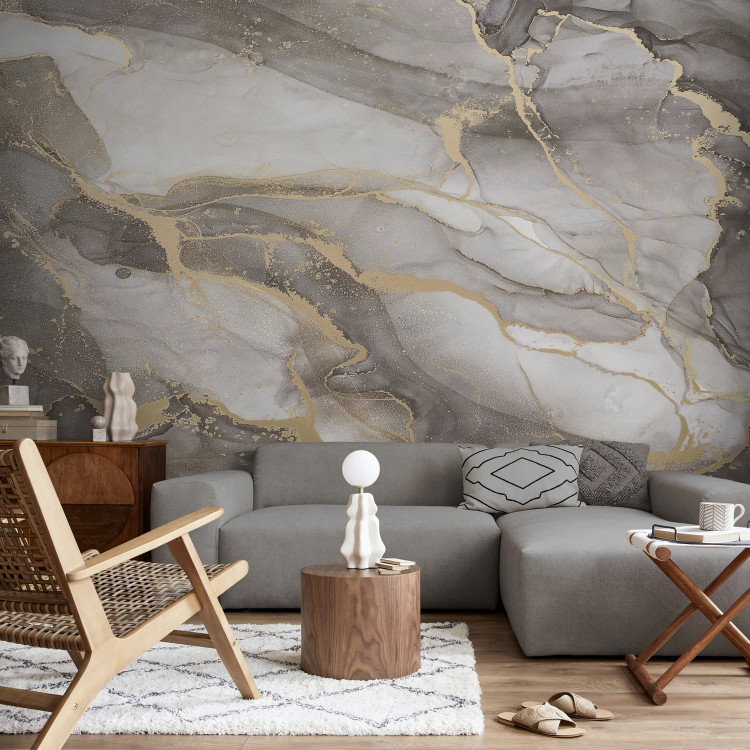
Find the location of a particular element. The height and width of the screenshot is (750, 750). 1 rug is located at coordinates (381, 699).